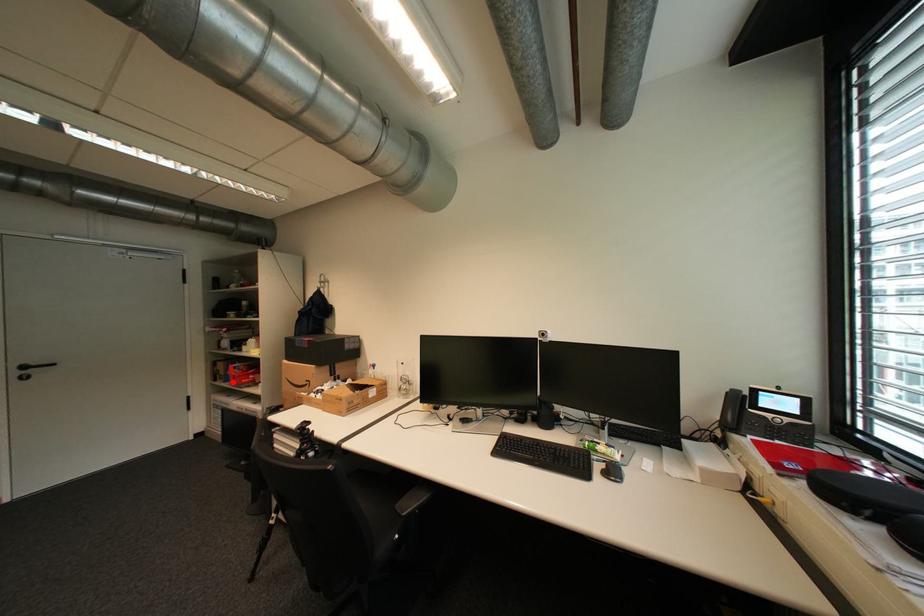
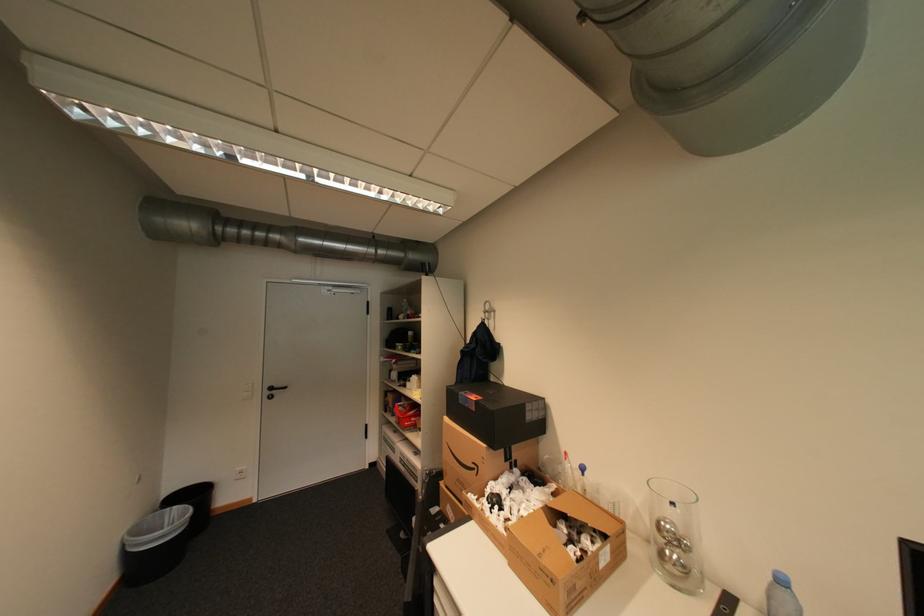
The point at the highlighted location is marked in the first image. Where is the corresponding point in the second image?

(400, 416)